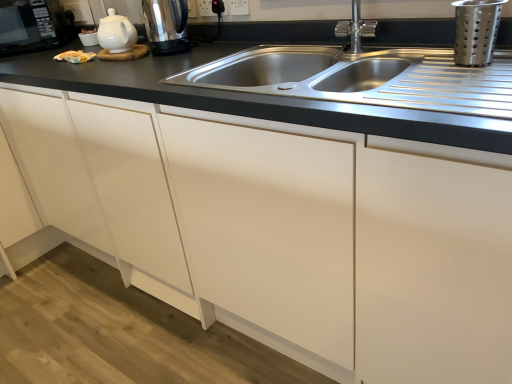
The height and width of the screenshot is (384, 512). Identify the location of matte white microwave at upper left, which is counted as the second appliance, starting from the bottom. (28, 26).

Locate an element on the screen. This screenshot has width=512, height=384. black plastic outlet at upper center, marked as the first electric outlet in a left-to-right arrangement is located at coordinates (211, 7).

The width and height of the screenshot is (512, 384). I want to click on metallic silver strainer at upper right, marked as the first appliance in a front-to-back arrangement, so click(476, 31).

Locate an element on the screen. Image resolution: width=512 pixels, height=384 pixels. white glossy teapot at upper left is located at coordinates (116, 33).

This screenshot has width=512, height=384. Describe the element at coordinates (356, 28) in the screenshot. I see `silver metallic faucet at upper center` at that location.

At what (x,y) coordinates should I click in order to perform the action: click on silver metallic faucet at upper center. Please return your answer as a coordinate pair (x, y). The height and width of the screenshot is (384, 512). Looking at the image, I should click on (356, 28).

The image size is (512, 384). What do you see at coordinates (247, 98) in the screenshot?
I see `stainless steel sink at center` at bounding box center [247, 98].

This screenshot has width=512, height=384. What are the coordinates of `polished stainless steel kettle at upper left` in the screenshot? It's located at (166, 26).

From the picture: Is stainless steel sink at center to the right of white plastic electric outlet at upper center, the 1th electric outlet when ordered from right to left, from the viewer's perspective?

Correct, you'll find stainless steel sink at center to the right of white plastic electric outlet at upper center, the 1th electric outlet when ordered from right to left.

Between stainless steel sink at center and white plastic electric outlet at upper center, the second electric outlet in the left-to-right sequence, which one has more height?

stainless steel sink at center.

Would you say stainless steel sink at center is inside or outside white plastic electric outlet at upper center, the second electric outlet in the left-to-right sequence?

stainless steel sink at center is spatially situated outside white plastic electric outlet at upper center, the second electric outlet in the left-to-right sequence.

From a real-world perspective, is stainless steel sink at center over white plastic electric outlet at upper center, the second electric outlet in the left-to-right sequence?

Actually, stainless steel sink at center is physically below white plastic electric outlet at upper center, the second electric outlet in the left-to-right sequence, in the real world.

Does polished stainless steel kettle at upper left have a greater width compared to silver metallic faucet at upper center?

Yes.

From the image's perspective, is polished stainless steel kettle at upper left beneath silver metallic faucet at upper center?

No, from the image's perspective, polished stainless steel kettle at upper left is not beneath silver metallic faucet at upper center.

Which of these two, polished stainless steel kettle at upper left or silver metallic faucet at upper center, stands taller?

Standing taller between the two is polished stainless steel kettle at upper left.

Is polished stainless steel kettle at upper left situated inside silver metallic faucet at upper center or outside?

polished stainless steel kettle at upper left is not enclosed by silver metallic faucet at upper center.

Can you confirm if stainless steel sink at center is smaller than matte white microwave at upper left, the 2th appliance from the right?

No, stainless steel sink at center is not smaller than matte white microwave at upper left, the 2th appliance from the right.

From a real-world perspective, which is physically above, stainless steel sink at center or matte white microwave at upper left, which is counted as the second appliance, starting from the bottom?

From a 3D spatial view, matte white microwave at upper left, which is counted as the second appliance, starting from the bottom, is above.

Is stainless steel sink at center aimed at matte white microwave at upper left, the 2th appliance positioned from the front?

No, stainless steel sink at center does not turn towards matte white microwave at upper left, the 2th appliance positioned from the front.

Is matte white microwave at upper left, the 2th appliance positioned from the front, turned away from white glossy teapot at upper left?

That's not correct — matte white microwave at upper left, the 2th appliance positioned from the front, is not looking away from white glossy teapot at upper left.

Is matte white microwave at upper left, which appears as the 1th appliance when viewed from the left, placed right next to white glossy teapot at upper left?

No, matte white microwave at upper left, which appears as the 1th appliance when viewed from the left, is not beside white glossy teapot at upper left.

Which of these two, matte white microwave at upper left, which is counted as the second appliance, starting from the bottom, or white glossy teapot at upper left, stands taller?

Standing taller between the two is matte white microwave at upper left, which is counted as the second appliance, starting from the bottom.

From a real-world perspective, is matte white microwave at upper left, which appears as the 1th appliance when viewed from the left, positioned under white glossy teapot at upper left based on gravity?

Incorrect, from a real-world perspective, matte white microwave at upper left, which appears as the 1th appliance when viewed from the left, is higher than white glossy teapot at upper left.

Which is behind, white plastic electric outlet at upper center, the 1th electric outlet when ordered from right to left, or white glossy teapot at upper left?

white plastic electric outlet at upper center, the 1th electric outlet when ordered from right to left, is further away from the camera.

In the scene shown: Which of these two, white plastic electric outlet at upper center, the second electric outlet in the left-to-right sequence, or white glossy teapot at upper left, is bigger?

With larger size is white glossy teapot at upper left.

Can you see white plastic electric outlet at upper center, the second electric outlet in the left-to-right sequence, touching white glossy teapot at upper left?

They are not placed beside each other.

Is white plastic electric outlet at upper center, the 1th electric outlet when ordered from right to left, positioned with its back to white glossy teapot at upper left?

No, white glossy teapot at upper left is not at the back of white plastic electric outlet at upper center, the 1th electric outlet when ordered from right to left.

Is point (356, 35) positioned before point (148, 4)?

Yes, point (356, 35) is closer to viewer.

Which of these two, silver metallic faucet at upper center or polished stainless steel kettle at upper left, is wider?

With larger width is polished stainless steel kettle at upper left.

Is silver metallic faucet at upper center turned away from polished stainless steel kettle at upper left?

No, silver metallic faucet at upper center is not facing the opposite direction of polished stainless steel kettle at upper left.

In the scene shown: Who is bigger, matte white microwave at upper left, the first appliance when ordered from back to front, or white plastic electric outlet at upper center, the second electric outlet in the left-to-right sequence?

matte white microwave at upper left, the first appliance when ordered from back to front, is bigger.

How far apart are matte white microwave at upper left, which is counted as the second appliance, starting from the bottom, and white plastic electric outlet at upper center, the second electric outlet in the left-to-right sequence?

3.41 feet.

Is matte white microwave at upper left, the 2th appliance from the right, positioned beyond the bounds of white plastic electric outlet at upper center, the 1th electric outlet when ordered from right to left?

Yes, matte white microwave at upper left, the 2th appliance from the right, is not within white plastic electric outlet at upper center, the 1th electric outlet when ordered from right to left.

Who is shorter, matte white microwave at upper left, which appears as the 1th appliance when viewed from the left, or white plastic electric outlet at upper center, the second electric outlet in the left-to-right sequence?

With less height is white plastic electric outlet at upper center, the second electric outlet in the left-to-right sequence.

Where is `countertop lying in front of the white plastic electric outlet at upper center, the second electric outlet in the left-to-right sequence`? This screenshot has height=384, width=512. countertop lying in front of the white plastic electric outlet at upper center, the second electric outlet in the left-to-right sequence is located at coordinates point(247,98).

This screenshot has height=384, width=512. Identify the location of tap lying on the right of polished stainless steel kettle at upper left. (356, 28).

When comparing their distances from metallic silver strainer at upper right, which is the first appliance from right to left, does stainless steel sink at center or white glossy teapot at upper left seem further?

white glossy teapot at upper left is positioned further to the anchor metallic silver strainer at upper right, which is the first appliance from right to left.

Considering their positions, is matte white microwave at upper left, the first appliance when ordered from back to front, positioned further to white glossy teapot at upper left than white plastic electric outlet at upper center, the second electric outlet in the left-to-right sequence?

matte white microwave at upper left, the first appliance when ordered from back to front.

Based on their spatial positions, is stainless steel sink at center or black plastic outlet at upper center, marked as the first electric outlet in a left-to-right arrangement, further from polished stainless steel kettle at upper left?

Based on the image, stainless steel sink at center appears to be further to polished stainless steel kettle at upper left.

Estimate the real-world distances between objects in this image. Which object is further from white plastic electric outlet at upper center, the second electric outlet in the left-to-right sequence, polished stainless steel kettle at upper left or matte white microwave at upper left, the first appliance when ordered from back to front?

matte white microwave at upper left, the first appliance when ordered from back to front, lies further to white plastic electric outlet at upper center, the second electric outlet in the left-to-right sequence, than the other object.

Considering their positions, is silver metallic faucet at upper center positioned closer to stainless steel sink at center than polished stainless steel kettle at upper left?

Among the two, polished stainless steel kettle at upper left is located nearer to stainless steel sink at center.

Looking at this image, when comparing their distances from white glossy teapot at upper left, does silver metallic faucet at upper center or stainless steel sink at center seem further?

Based on the image, silver metallic faucet at upper center appears to be further to white glossy teapot at upper left.

Considering their positions, is white glossy teapot at upper left positioned further to metallic silver strainer at upper right, arranged as the 1th appliance when ordered from the bottom, than white plastic electric outlet at upper center, the second electric outlet in the left-to-right sequence?

white glossy teapot at upper left is positioned further to the anchor metallic silver strainer at upper right, arranged as the 1th appliance when ordered from the bottom.

When comparing their distances from white plastic electric outlet at upper center, the 1th electric outlet when ordered from right to left, does silver metallic faucet at upper center or metallic silver strainer at upper right, positioned as the 2th appliance in left-to-right order, seem closer?

The object closer to white plastic electric outlet at upper center, the 1th electric outlet when ordered from right to left, is silver metallic faucet at upper center.

The image size is (512, 384). Identify the location of appliance between stainless steel sink at center and silver metallic faucet at upper center in the front-back direction. (476, 31).

The width and height of the screenshot is (512, 384). What are the coordinates of `tea pot situated between matte white microwave at upper left, the first appliance when ordered from back to front, and metallic silver strainer at upper right, which is the first appliance from right to left, from left to right` in the screenshot? It's located at (116, 33).

You are a GUI agent. You are given a task and a screenshot of the screen. Output one action in this format:
    pyautogui.click(x=<x>, y=<y>)
    Task: Click on the appliance between stainless steel sink at center and white plastic electric outlet at upper center, the second electric outlet in the left-to-right sequence, along the z-axis
    The height and width of the screenshot is (384, 512).
    Given the screenshot: What is the action you would take?
    pyautogui.click(x=476, y=31)

Where is `countertop between polished stainless steel kettle at upper left and metallic silver strainer at upper right, the second appliance in the top-to-bottom sequence`? The image size is (512, 384). countertop between polished stainless steel kettle at upper left and metallic silver strainer at upper right, the second appliance in the top-to-bottom sequence is located at coordinates (247, 98).